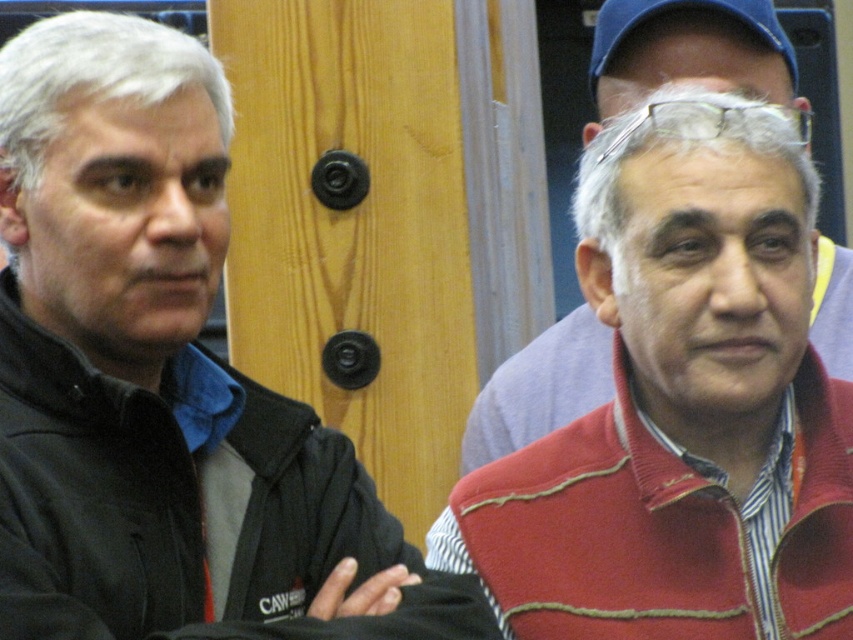
Question: Which object is the farthest from the gray matte hair at upper left?

Choices:
 (A) red matte sweater at right
 (B) black matte jacket at left
 (C) blue fabric cap at upper center
 (D) gray matte hair at center

Answer: (A)

Question: Among these objects, which one is farthest from the camera?

Choices:
 (A) red matte sweater at right
 (B) gray matte hair at center

Answer: (A)

Question: Estimate the real-world distances between objects in this image. Which object is farther from the red matte sweater at right?

Choices:
 (A) gray matte hair at upper left
 (B) black matte jacket at left

Answer: (A)

Question: Can you confirm if red matte sweater at right is positioned to the left of gray matte hair at center?

Choices:
 (A) no
 (B) yes

Answer: (B)

Question: Is gray matte hair at upper left bigger than red matte sweater at right?

Choices:
 (A) yes
 (B) no

Answer: (B)

Question: Can you confirm if black matte jacket at left is positioned above gray matte hair at upper left?

Choices:
 (A) yes
 (B) no

Answer: (B)